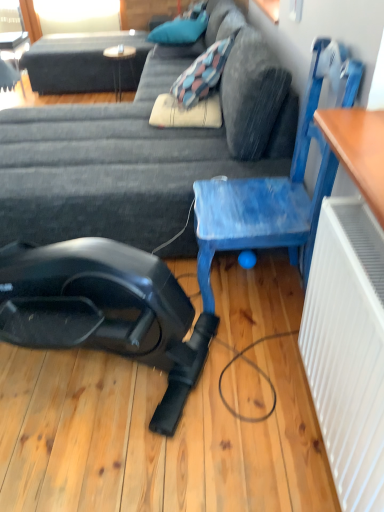
Question: Is wooden table at upper center aimed at blue painted wood chair at center right?

Choices:
 (A) no
 (B) yes

Answer: (B)

Question: Is wooden table at upper center to the left of blue painted wood chair at center right from the viewer's perspective?

Choices:
 (A) no
 (B) yes

Answer: (B)

Question: Is wooden table at upper center smaller than blue painted wood chair at center right?

Choices:
 (A) yes
 (B) no

Answer: (A)

Question: Is the surface of wooden table at upper center in direct contact with blue painted wood chair at center right?

Choices:
 (A) no
 (B) yes

Answer: (A)

Question: Is the depth of wooden table at upper center less than that of blue painted wood chair at center right?

Choices:
 (A) yes
 (B) no

Answer: (B)

Question: From a real-world perspective, is blue fabric pillow at upper center physically located above or below dark gray fabric couch at center?

Choices:
 (A) below
 (B) above

Answer: (B)

Question: Is point (165, 35) positioned closer to the camera than point (112, 112)?

Choices:
 (A) farther
 (B) closer

Answer: (A)

Question: From the image's perspective, is blue fabric pillow at upper center positioned above or below dark gray fabric couch at center?

Choices:
 (A) below
 (B) above

Answer: (B)

Question: Considering the positions of blue fabric pillow at upper center and dark gray fabric couch at center in the image, is blue fabric pillow at upper center taller or shorter than dark gray fabric couch at center?

Choices:
 (A) tall
 (B) short

Answer: (B)

Question: Is wooden table at upper center wider or thinner than blue fabric pillow at upper center?

Choices:
 (A) thin
 (B) wide

Answer: (A)

Question: From the image's perspective, is wooden table at upper center located above or below blue fabric pillow at upper center?

Choices:
 (A) below
 (B) above

Answer: (A)

Question: Considering their positions, is wooden table at upper center located in front of or behind blue fabric pillow at upper center?

Choices:
 (A) front
 (B) behind

Answer: (B)

Question: Is wooden table at upper center inside or outside of blue fabric pillow at upper center?

Choices:
 (A) inside
 (B) outside

Answer: (B)

Question: From a real-world perspective, is blue painted wood chair at center right physically located above or below blue fabric pillow at upper center?

Choices:
 (A) below
 (B) above

Answer: (A)

Question: In terms of height, does blue painted wood chair at center right look taller or shorter compared to blue fabric pillow at upper center?

Choices:
 (A) short
 (B) tall

Answer: (B)